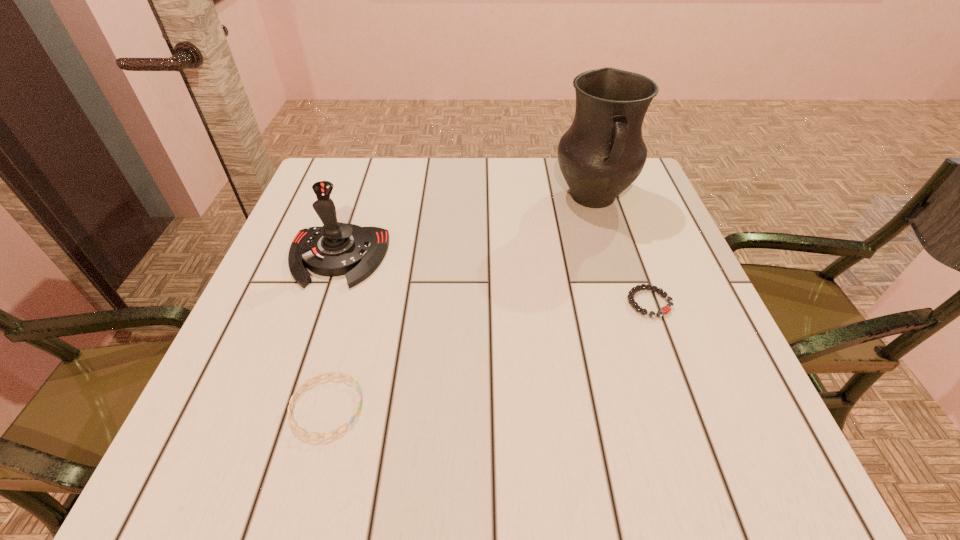
This screenshot has width=960, height=540. What are the coordinates of `the tallest object` in the screenshot? It's located at (602, 153).

Locate an element on the screen. This screenshot has width=960, height=540. pitcher is located at coordinates (602, 153).

At what (x,y) coordinates should I click in order to perform the action: click on joystick. Please return your answer as a coordinate pair (x, y). Looking at the image, I should click on (335, 249).

The height and width of the screenshot is (540, 960). Identify the location of the nearer bracelet. (290, 419).

Image resolution: width=960 pixels, height=540 pixels. I want to click on the nearest object, so click(290, 419).

The width and height of the screenshot is (960, 540). I want to click on the right bracelet, so click(x=666, y=309).

Find the location of a particular element. the farther bracelet is located at coordinates (666, 309).

Where is `free point located on the handle side of the tallest object`? Image resolution: width=960 pixels, height=540 pixels. free point located on the handle side of the tallest object is located at coordinates (612, 259).

I want to click on free space located on the handle side of the third shortest object, so click(286, 411).

I want to click on vacant space situated 0.280m on the surface of the nearer bracelet showing star-shaped elements, so click(x=535, y=407).